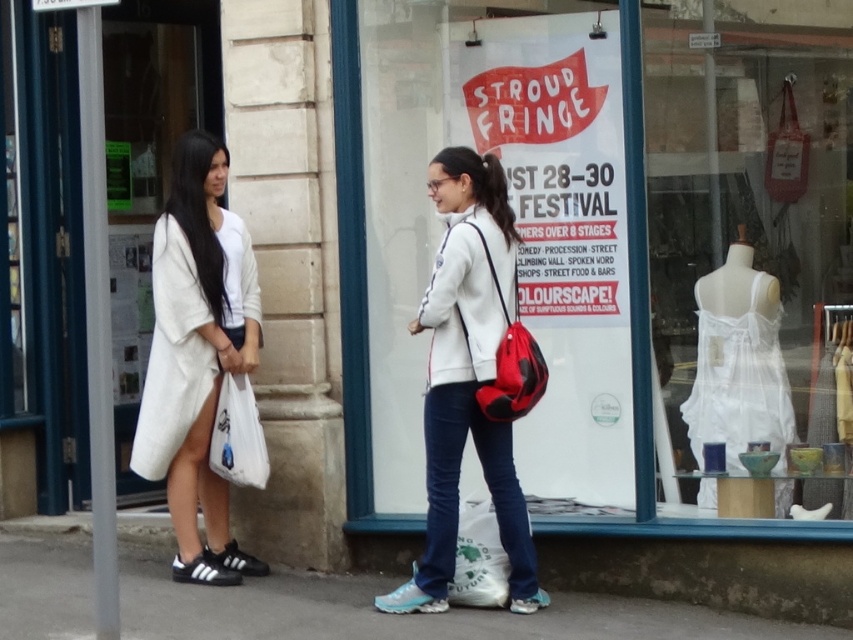
Does white sheer fabric dress at right come behind gray concrete pavement at lower center?

Yes, it is.

Between white sheer fabric dress at right and gray concrete pavement at lower center, which one appears on the left side from the viewer's perspective?

From the viewer's perspective, gray concrete pavement at lower center appears more on the left side.

You are a GUI agent. You are given a task and a screenshot of the screen. Output one action in this format:
    pyautogui.click(x=<x>, y=<y>)
    Task: Click on the white sheer fabric dress at right
    This screenshot has width=853, height=640.
    Given the screenshot: What is the action you would take?
    pyautogui.click(x=752, y=232)

Can you confirm if white sheer fabric dress at right is wider than white cotton coat at left?

Indeed, white sheer fabric dress at right has a greater width compared to white cotton coat at left.

Is white sheer fabric dress at right smaller than white cotton coat at left?

Actually, white sheer fabric dress at right might be larger than white cotton coat at left.

Locate an element on the screen. white sheer fabric dress at right is located at coordinates (752, 232).

Image resolution: width=853 pixels, height=640 pixels. Identify the location of white sheer fabric dress at right. (752, 232).

Is gray concrete pavement at lower center to the left of white matte jacket at center from the viewer's perspective?

Correct, you'll find gray concrete pavement at lower center to the left of white matte jacket at center.

Does gray concrete pavement at lower center have a greater height compared to white matte jacket at center?

In fact, gray concrete pavement at lower center may be shorter than white matte jacket at center.

This screenshot has width=853, height=640. Identify the location of gray concrete pavement at lower center. (405, 616).